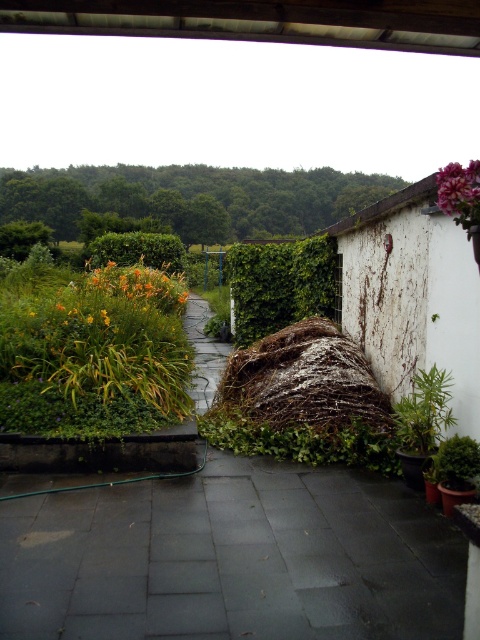
You are standing at the edge of the paved pathway in the garden scene. You see two points marked in the image. The first point is at coordinate (315,497) and the second is at (459,196). Which point is closer to your current position?

Point (315,497) is closer to your current position because it is further to the camera than point (459,196).

You are standing at the edge of the green stone path at center and want to walk towards the white wall with vines. Which direction should you go relative to the green leafy vegetation at upper center?

You should walk away from the green leafy vegetation at upper center because the green stone path at center is in front of it, meaning the white wall with vines is behind the vegetation.